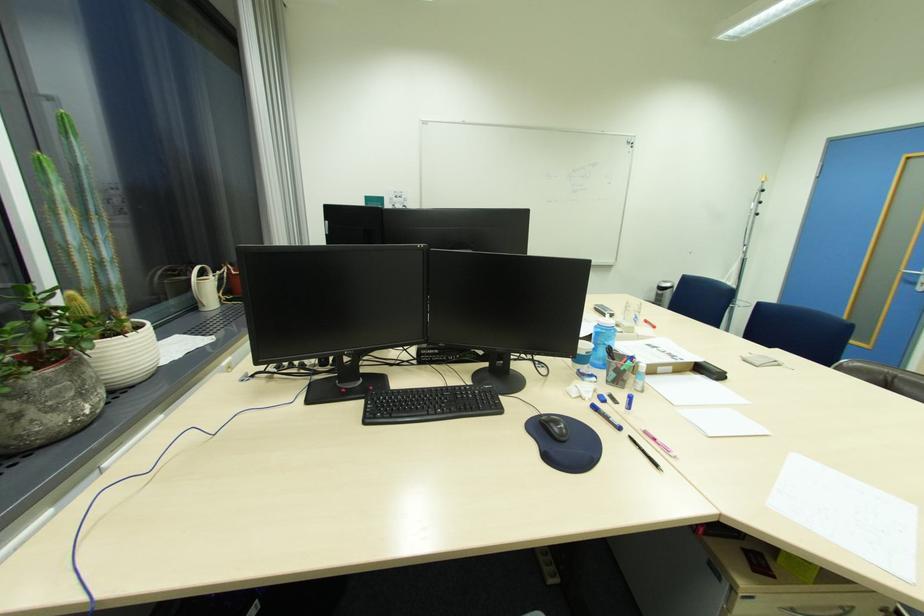
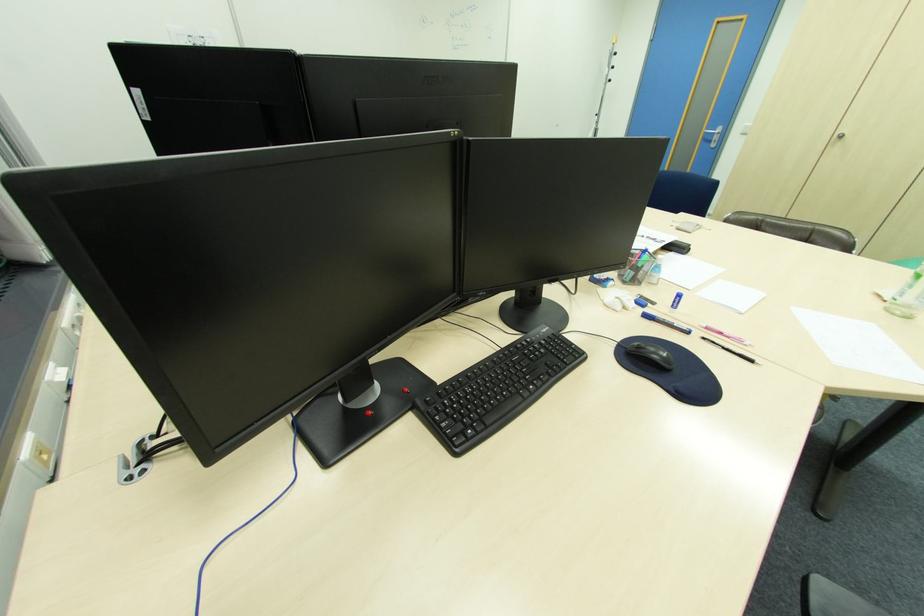
Locate, in the second image, the point that corresponds to the point at 651,432 in the first image.

(712, 328)